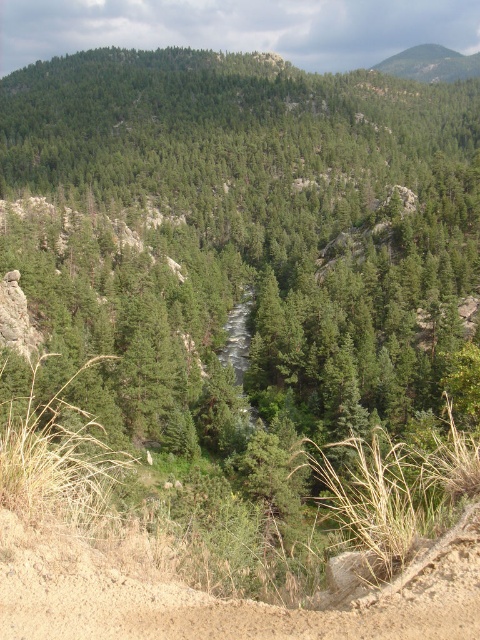
Does brown sandy dirt track at lower left appear under green textured rock at upper right?

Indeed, brown sandy dirt track at lower left is positioned under green textured rock at upper right.

Which is in front, point (458, 566) or point (406, 56)?

Point (458, 566) is more forward.

Where is `brown sandy dirt track at lower left`? brown sandy dirt track at lower left is located at coordinates (207, 600).